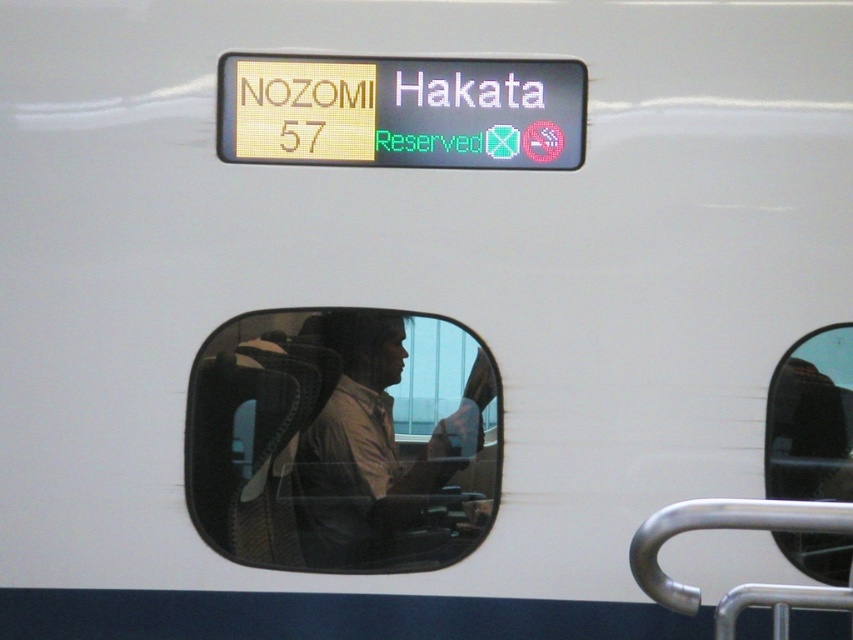
You are a delivery robot with a box that is 15 inches wide. You need to pass between the transparent glass train window at center and the yellow plastic sign at upper center. Can you fit through the space between them?

The transparent glass train window at center and yellow plastic sign at upper center are 14.68 inches apart from each other. Since your box is 15 inches wide, it is slightly wider than the available space, so you cannot fit through the space between them.

You are a passenger on the train and want to check the current train number and destination. You see the transparent glass train window at center and the yellow plastic sign at upper center. Which object should you look at to find this information?

You should look at the yellow plastic sign at upper center to find the current train number and destination, as the transparent glass train window at center is a window reflecting the interior and not displaying text information.